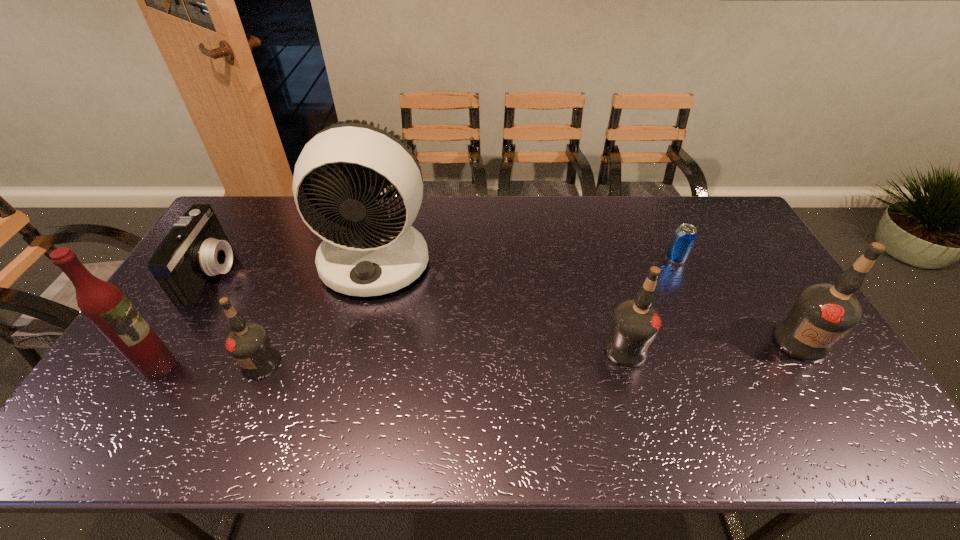
The width and height of the screenshot is (960, 540). I want to click on vacant region located 0.250m on the front label of the fifth object from left to right, so click(x=740, y=349).

The height and width of the screenshot is (540, 960). Identify the location of free space located 0.300m on the lens of the sixth tallest object. (327, 273).

Where is `free space located 0.280m on the front of the shortest object`? free space located 0.280m on the front of the shortest object is located at coordinates (711, 335).

Identify the location of free space located on the grille of the fan. (360, 322).

You are a GUI agent. You are given a task and a screenshot of the screen. Output one action in this format:
    pyautogui.click(x=<x>, y=<y>)
    Task: Click on the free spot located on the label of the liquor
    
    Given the screenshot: What is the action you would take?
    pyautogui.click(x=235, y=366)

Locate an element on the screen. object that is at the far edge is located at coordinates (365, 252).

Where is `vodka at the near edge`? vodka at the near edge is located at coordinates (248, 343).

Identify the location of liquor that is at the near edge. This screenshot has width=960, height=540. (104, 304).

At what (x,y) coordinates should I click in order to perform the action: click on camcorder situated at the left edge. Please return your answer as a coordinate pair (x, y). Looking at the image, I should click on tap(196, 248).

Find the location of a particular element. Image resolution: width=960 pixels, height=540 pixels. liquor situated at the left edge is located at coordinates pyautogui.click(x=104, y=304).